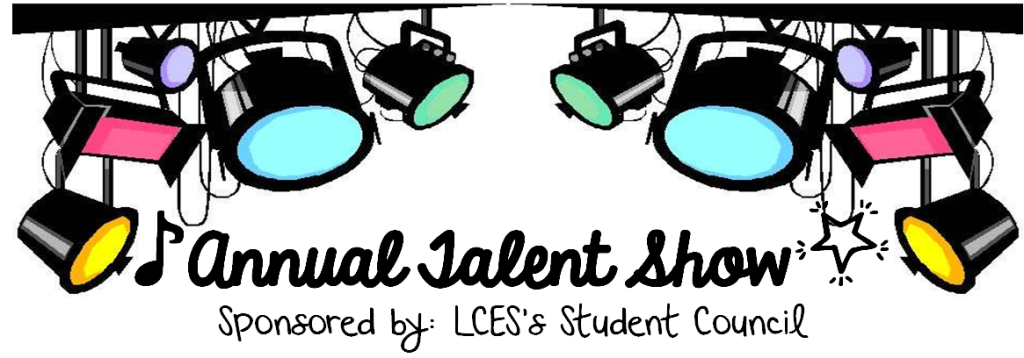
Image resolution: width=1024 pixels, height=358 pixels. I want to click on green light, so click(x=580, y=95).